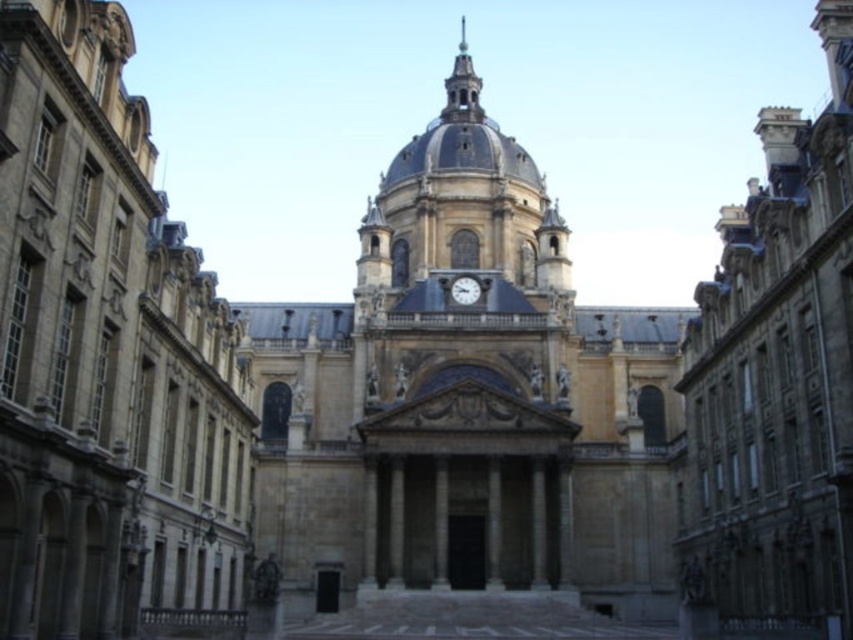
Question: Which point is farther to the camera?

Choices:
 (A) metallic gray clock at center
 (B) polished copper spire at upper center

Answer: (B)

Question: Can you confirm if polished copper spire at upper center is smaller than metallic gray clock at center?

Choices:
 (A) no
 (B) yes

Answer: (A)

Question: Does polished copper spire at upper center lie behind metallic gray clock at center?

Choices:
 (A) no
 (B) yes

Answer: (B)

Question: Which point is farther from the camera taking this photo?

Choices:
 (A) (465, 292)
 (B) (469, 109)

Answer: (B)

Question: Which object appears closest to the camera in this image?

Choices:
 (A) metallic gray clock at center
 (B) polished copper spire at upper center

Answer: (A)

Question: Observing the image, what is the correct spatial positioning of polished copper spire at upper center in reference to metallic gray clock at center?

Choices:
 (A) right
 (B) left

Answer: (A)